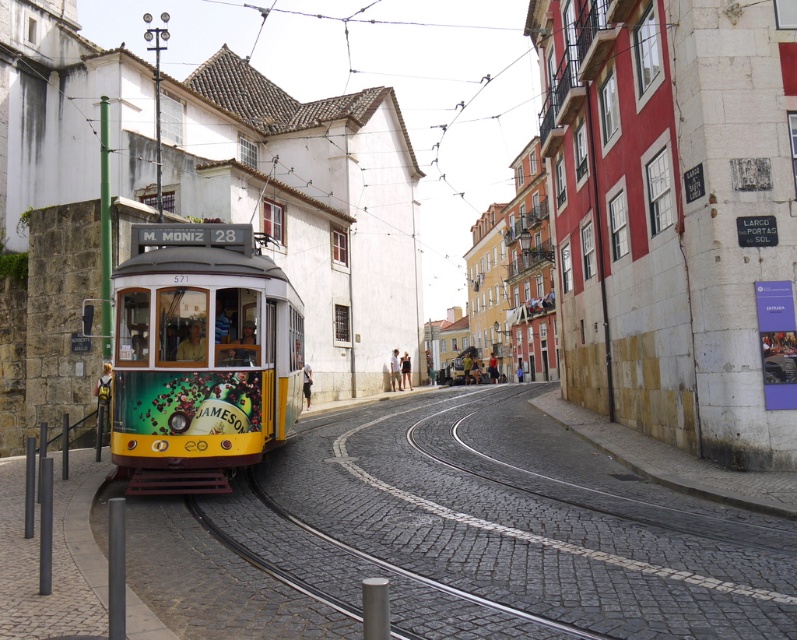
Based on the photo, you are standing at the intersection and want to cross the street to reach the tram M. MONIZ 28. There is a yellow rubber track at lower left marked by point (501, 529). Is the track to your left or right when facing the tram?

The yellow rubber track at lower left is to your left when facing the tram.

You are standing on the street in Lisbon and want to take a photo of the tram M. MONIZ 28. There is a point at coordinates point (582,618) that is 5.56 meters away from you. If you move 2 meters closer to the tram, will you be closer to the tram than the point?

The point is 5.56 meters away from you. If you move 2 meters closer, your new distance would be 5.56 meters minus 2 meters, which is 3.56 meters. Since 3.56 meters is less than 5.56 meters, you would be closer to the tram than the point.

You are standing at the position of the tram and want to walk to the point labeled point (x=136, y=486). Which direction should you move relative to the point labeled point (x=354, y=468)?

To reach point (x=136, y=486) from the tram, you should move away from point (x=354, y=468) because point (x=354, y=468) is closer to the camera than point (x=136, y=486).